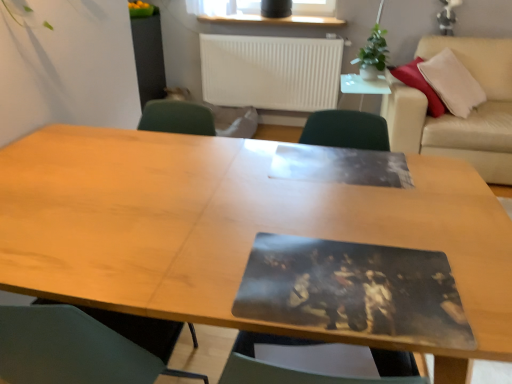
Question: Would you say white matte radiator at upper center is outside wooden table at center?

Choices:
 (A) yes
 (B) no

Answer: (A)

Question: Does white matte radiator at upper center have a larger size compared to wooden table at center?

Choices:
 (A) yes
 (B) no

Answer: (B)

Question: From the image's perspective, is white matte radiator at upper center over wooden table at center?

Choices:
 (A) no
 (B) yes

Answer: (B)

Question: Is white matte radiator at upper center at the left side of wooden table at center?

Choices:
 (A) no
 (B) yes

Answer: (A)

Question: From a real-world perspective, does white matte radiator at upper center sit lower than wooden table at center?

Choices:
 (A) no
 (B) yes

Answer: (A)

Question: Considering the relative positions of white matte radiator at upper center and wooden table at center in the image provided, is white matte radiator at upper center to the right of wooden table at center from the viewer's perspective?

Choices:
 (A) no
 (B) yes

Answer: (B)

Question: Does beige leather couch at upper right have a larger size compared to white matte radiator at upper center?

Choices:
 (A) no
 (B) yes

Answer: (B)

Question: Considering the relative sizes of beige leather couch at upper right and white matte radiator at upper center in the image provided, is beige leather couch at upper right taller than white matte radiator at upper center?

Choices:
 (A) no
 (B) yes

Answer: (B)

Question: Can you confirm if beige leather couch at upper right is positioned to the right of white matte radiator at upper center?

Choices:
 (A) yes
 (B) no

Answer: (A)

Question: Does beige leather couch at upper right come in front of white matte radiator at upper center?

Choices:
 (A) no
 (B) yes

Answer: (B)

Question: Is white matte radiator at upper center located within beige leather couch at upper right?

Choices:
 (A) yes
 (B) no

Answer: (B)

Question: From a real-world perspective, is beige leather couch at upper right below white matte radiator at upper center?

Choices:
 (A) no
 (B) yes

Answer: (B)

Question: From the image's perspective, does white glossy side table at upper center appear lower than green leafy plant at upper right?

Choices:
 (A) yes
 (B) no

Answer: (A)